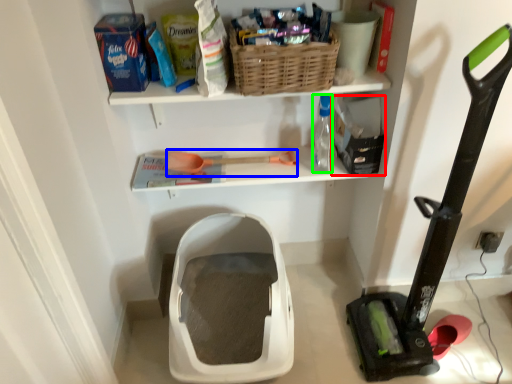
Question: Which object is positioned closest to storage box (highlighted by a red box)? Select from tool (highlighted by a blue box) and bottle (highlighted by a green box).

Choices:
 (A) tool
 (B) bottle

Answer: (B)